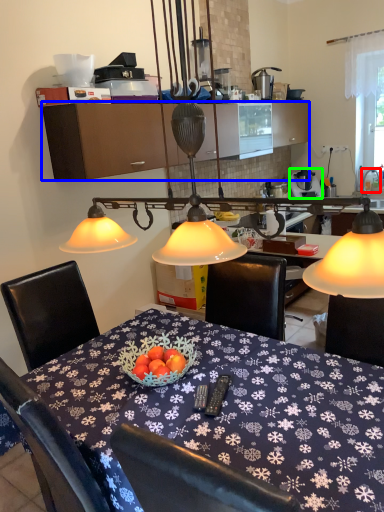
Question: Which object is the farthest from faucet (highlighted by a red box)? Choose among these: cabinetry (highlighted by a blue box) or appliance (highlighted by a green box).

Choices:
 (A) cabinetry
 (B) appliance

Answer: (A)